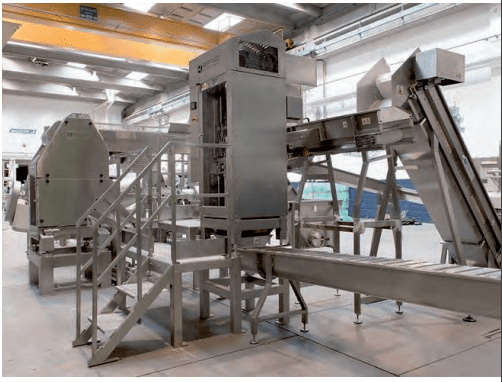
Identify the location of yellow beams. (151, 28), (140, 49).